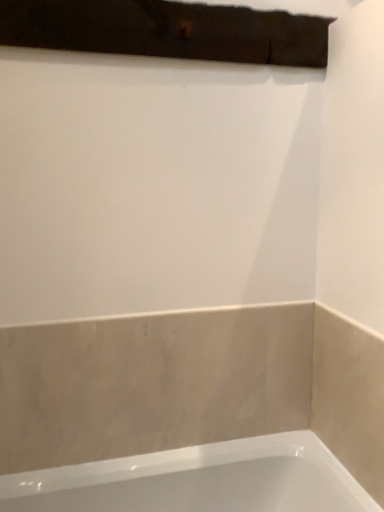
Identify the location of white glossy bathtub at lower center. The width and height of the screenshot is (384, 512). (198, 480).

This screenshot has width=384, height=512. What do you see at coordinates (198, 480) in the screenshot?
I see `white glossy bathtub at lower center` at bounding box center [198, 480].

The image size is (384, 512). I want to click on white glossy bathtub at lower center, so click(198, 480).